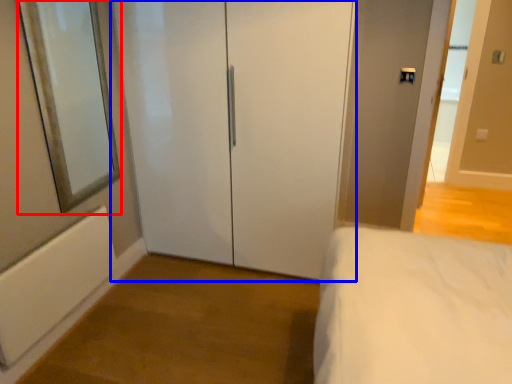
Question: Which object is further to the camera taking this photo, mirror (highlighted by a red box) or door (highlighted by a blue box)?

Choices:
 (A) mirror
 (B) door

Answer: (B)